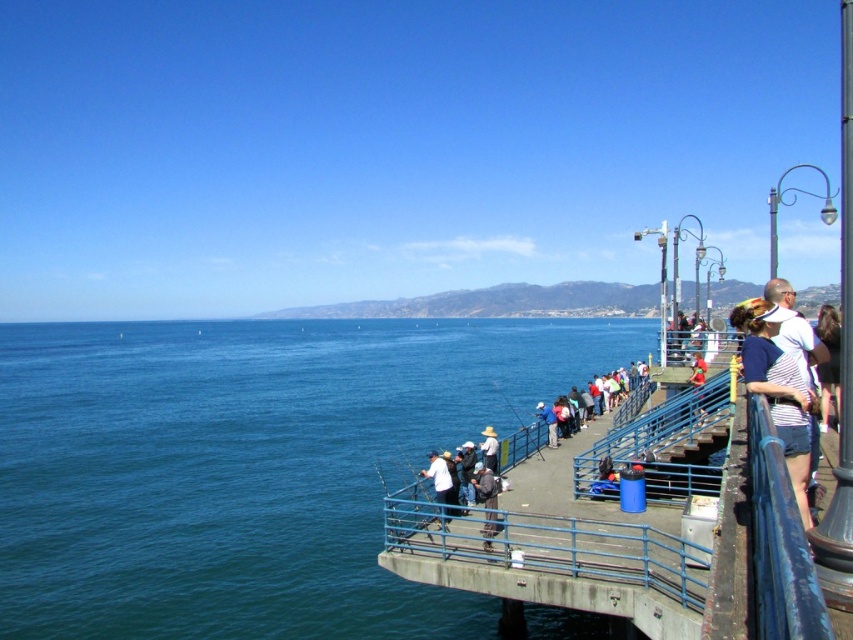
Question: Which object is closer to the camera taking this photo?

Choices:
 (A) white matte shirt at center
 (B) dark brown hair at right
 (C) white cotton hat at center
 (D) white striped shirt at right

Answer: (D)

Question: Which object appears farthest from the camera in this image?

Choices:
 (A) dark brown hair at right
 (B) white striped shirt at right

Answer: (A)

Question: Is dark brown hair at right bigger than white cotton hat at center?

Choices:
 (A) no
 (B) yes

Answer: (B)

Question: Is blue water at center bigger than dark brown hair at right?

Choices:
 (A) yes
 (B) no

Answer: (B)

Question: Estimate the real-world distances between objects in this image. Which object is farther from the white cotton hat at center?

Choices:
 (A) white matte shirt at center
 (B) dark brown hair at right
 (C) blue water at center
 (D) white striped shirt at right

Answer: (C)

Question: Is blue water at center wider than white cotton hat at center?

Choices:
 (A) yes
 (B) no

Answer: (A)